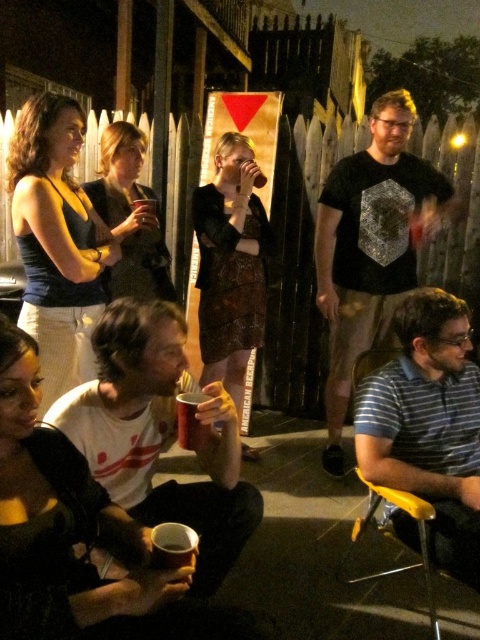
At what (x,y) coordinates should I click in order to perform the action: click on black matte t-shirt at center. Please return your answer as a coordinate pair (x, y). This screenshot has height=640, width=480. Looking at the image, I should click on (371, 248).

Which is above, black matte t-shirt at center or yellow plastic chair at lower right?

black matte t-shirt at center is higher up.

Between point (360, 257) and point (367, 525), which one is positioned behind?

The point (360, 257) is more distant.

Find the location of a particular element. The height and width of the screenshot is (640, 480). black matte t-shirt at center is located at coordinates click(x=371, y=248).

In the scene shown: Does white matte t-shirt at lower left have a greater width compared to white matte cup at lower center?

Indeed, white matte t-shirt at lower left has a greater width compared to white matte cup at lower center.

Does white matte t-shirt at lower left have a smaller size compared to white matte cup at lower center?

Actually, white matte t-shirt at lower left might be larger than white matte cup at lower center.

Locate an element on the screen. The image size is (480, 640). white matte t-shirt at lower left is located at coordinates (158, 435).

At what (x,y) coordinates should I click in order to perform the action: click on white matte t-shirt at lower left. Please return your answer as a coordinate pair (x, y). Looking at the image, I should click on (158, 435).

Who is shorter, white matte t-shirt at lower left or black matte t-shirt at center?

white matte t-shirt at lower left

Can you confirm if white matte t-shirt at lower left is positioned above black matte t-shirt at center?

No, white matte t-shirt at lower left is not above black matte t-shirt at center.

Find the location of a particular element. The image size is (480, 640). white matte t-shirt at lower left is located at coordinates (158, 435).